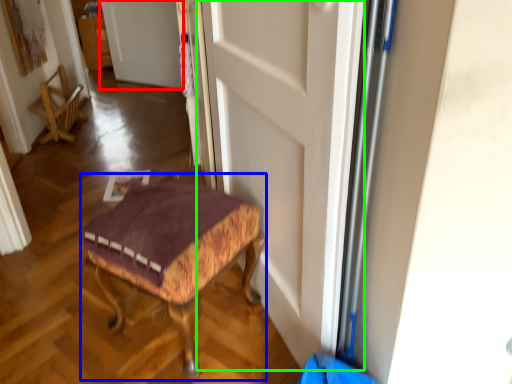
Question: Which object is positioned closest to door (highlighted by a red box)? Select from furniture (highlighted by a blue box) and door (highlighted by a green box).

Choices:
 (A) furniture
 (B) door

Answer: (B)